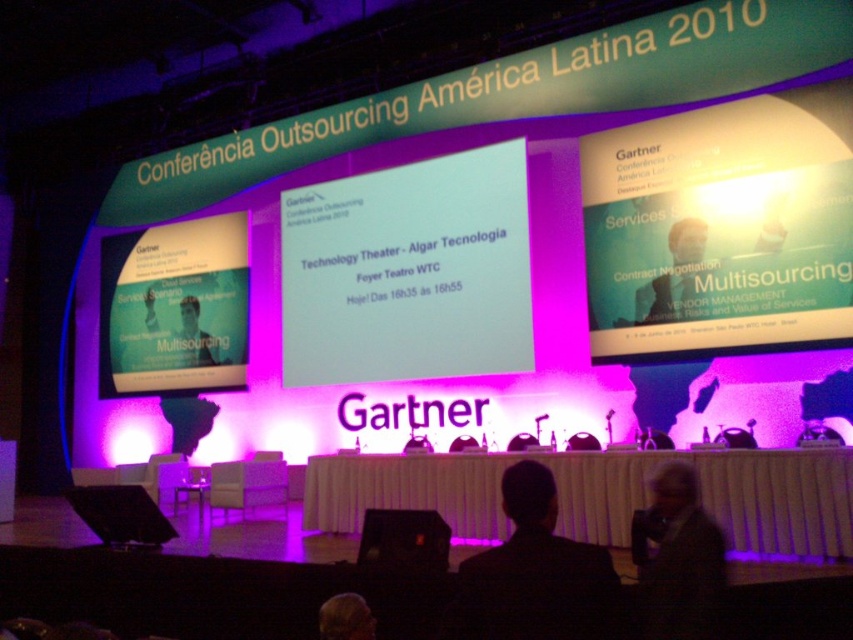
Which is below, matte white projector screen at upper right or matte white text at center?

matte white text at center

Does matte white projector screen at upper right have a lesser height compared to matte white text at center?

Incorrect, matte white projector screen at upper right's height does not fall short of matte white text at center's.

The width and height of the screenshot is (853, 640). What do you see at coordinates (721, 228) in the screenshot?
I see `matte white projector screen at upper right` at bounding box center [721, 228].

I want to click on matte white projector screen at upper right, so click(x=721, y=228).

Does point (556, 592) come farther from viewer compared to point (677, 548)?

No, it is not.

Is black suit at center to the right of gray fabric at lower right from the viewer's perspective?

Incorrect, black suit at center is not on the right side of gray fabric at lower right.

Is point (601, 592) farther from viewer compared to point (670, 538)?

No, it is not.

I want to click on black suit at center, so click(537, 573).

Does matte white projector screen at upper right appear on the right side of black suit at center?

Yes, matte white projector screen at upper right is to the right of black suit at center.

Which is behind, point (666, 196) or point (556, 560)?

Positioned behind is point (666, 196).

Find the location of `matte white projector screen at upper right`. matte white projector screen at upper right is located at coordinates (721, 228).